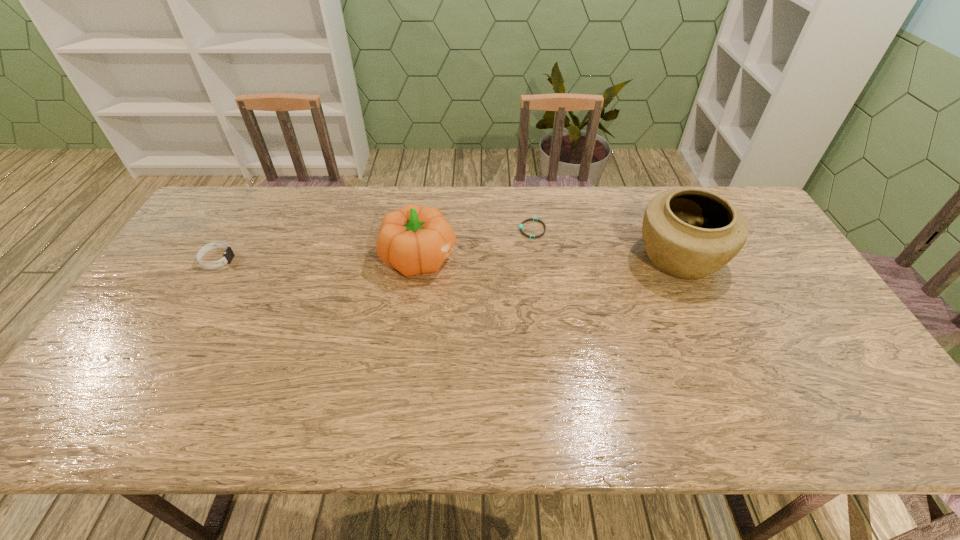
Locate an element on the screen. empty location between the pumpkin and the rightmost object is located at coordinates (550, 258).

Locate which object ranks second in proximity to the pumpkin. Please provide its 2D coordinates. Your answer should be formatted as a tuple, i.e. [(x, y)], where the tuple contains the x and y coordinates of a point satisfying the conditions above.

[(228, 255)]

Where is `object that stands as the closest to the rightmost object`? This screenshot has width=960, height=540. object that stands as the closest to the rightmost object is located at coordinates (530, 219).

At what (x,y) coordinates should I click in order to perform the action: click on free region that satisfies the following two spatial constraints: 1. on the back side of the pottery; 2. on the buckle of the farther wristband. Please return your answer as a coordinate pair (x, y). Image resolution: width=960 pixels, height=540 pixels. Looking at the image, I should click on (666, 230).

The width and height of the screenshot is (960, 540). I want to click on blank area in the image that satisfies the following two spatial constraints: 1. on the buckle of the shorter wristband; 2. on the back side of the pottery, so click(536, 258).

This screenshot has height=540, width=960. I want to click on vacant region that satisfies the following two spatial constraints: 1. on the buckle of the farther wristband; 2. on the back side of the rightmost object, so click(x=536, y=258).

You are a GUI agent. You are given a task and a screenshot of the screen. Output one action in this format:
    pyautogui.click(x=<x>, y=<y>)
    Task: Click on the vacant space that satisfies the following two spatial constraints: 1. on the buckle of the shorter wristband; 2. on the back side of the rightmost object
    The width and height of the screenshot is (960, 540).
    Given the screenshot: What is the action you would take?
    pyautogui.click(x=536, y=258)

You are a GUI agent. You are given a task and a screenshot of the screen. Output one action in this format:
    pyautogui.click(x=<x>, y=<y>)
    Task: Click on the vacant region that satisfies the following two spatial constraints: 1. on the buckle of the right wristband; 2. on the left side of the rightmost object
    The image size is (960, 540).
    Given the screenshot: What is the action you would take?
    pyautogui.click(x=536, y=258)